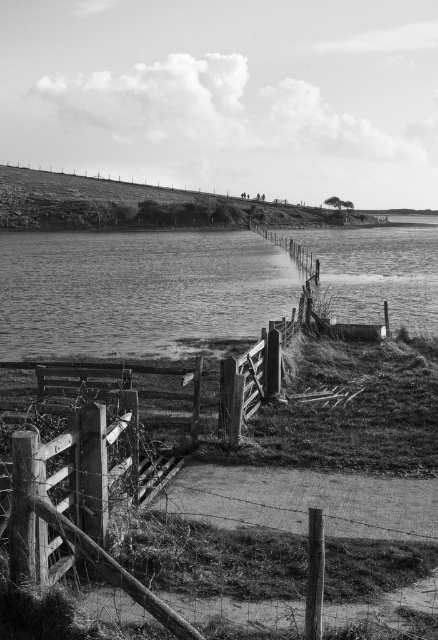
You are standing at the edge of the dirt path and see the smooth water at lower left and the wooden gate at lower left. Which object is higher up in the image?

The smooth water at lower left is taller than the wooden gate at lower left, so the smooth water at lower left is higher up in the image.

You are standing at the entrance of the scene and see the smooth water at lower left and the wooden gate at lower left. Which object is positioned more to your left side?

The smooth water at lower left is positioned to the left of the wooden gate at lower left, so the smooth water at lower left is more to the left side.